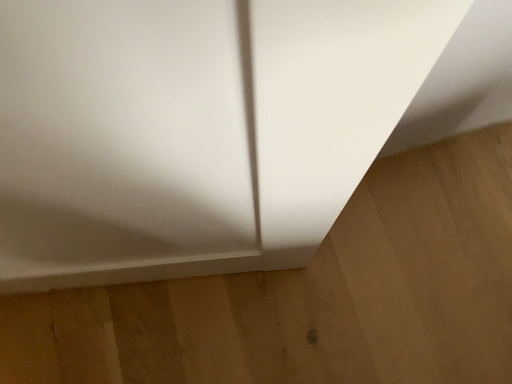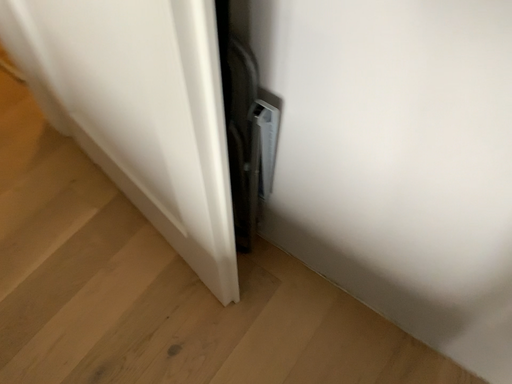
Question: How did the camera likely rotate when shooting the video?

Choices:
 (A) rotated left
 (B) rotated right

Answer: (A)